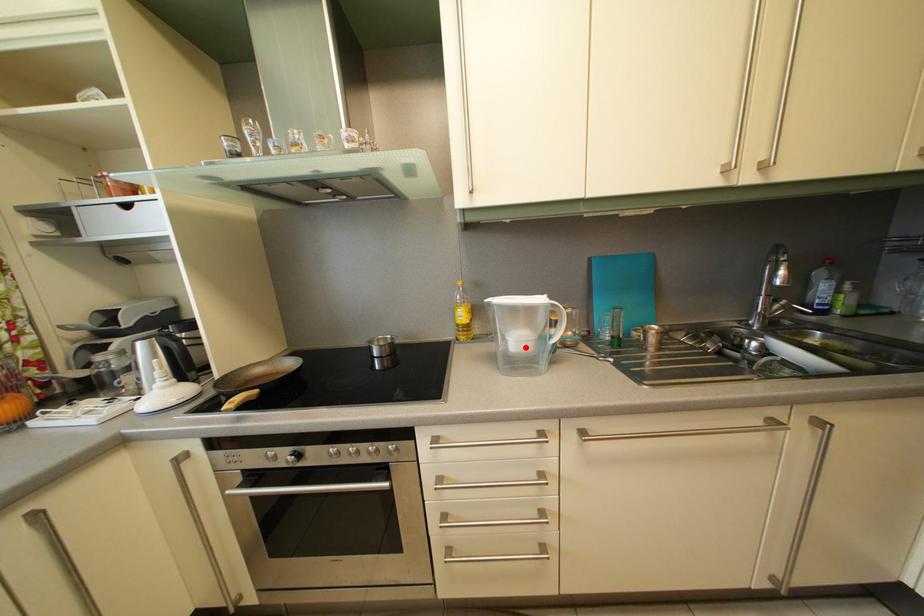
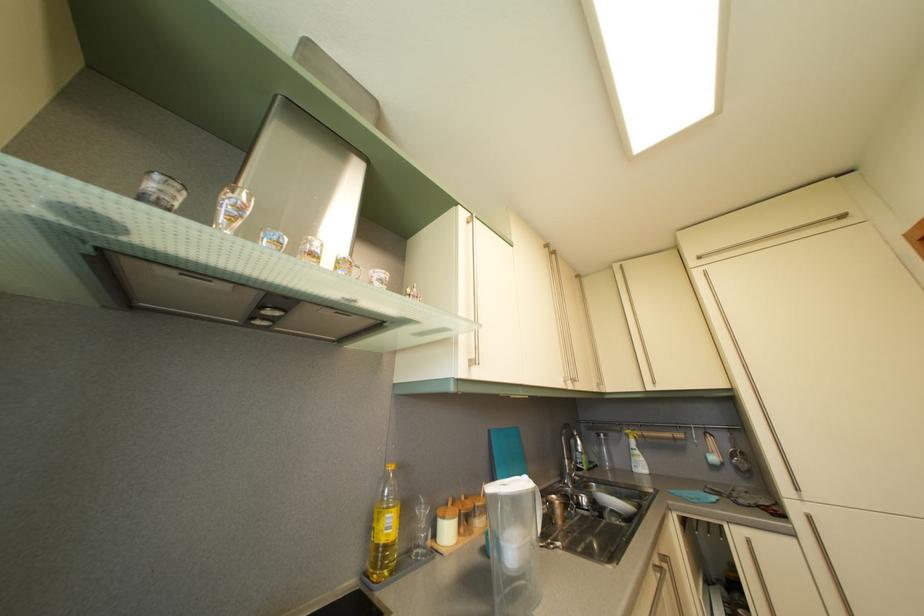
Locate, in the second image, the point that corresponds to the highlighted location in the first image.

(521, 554)